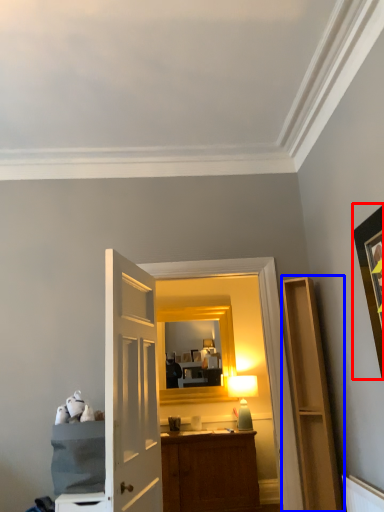
Question: Which of the following is the farthest to the observer, picture frame (highlighted by a red box) or cabinetry (highlighted by a blue box)?

Choices:
 (A) picture frame
 (B) cabinetry

Answer: (B)